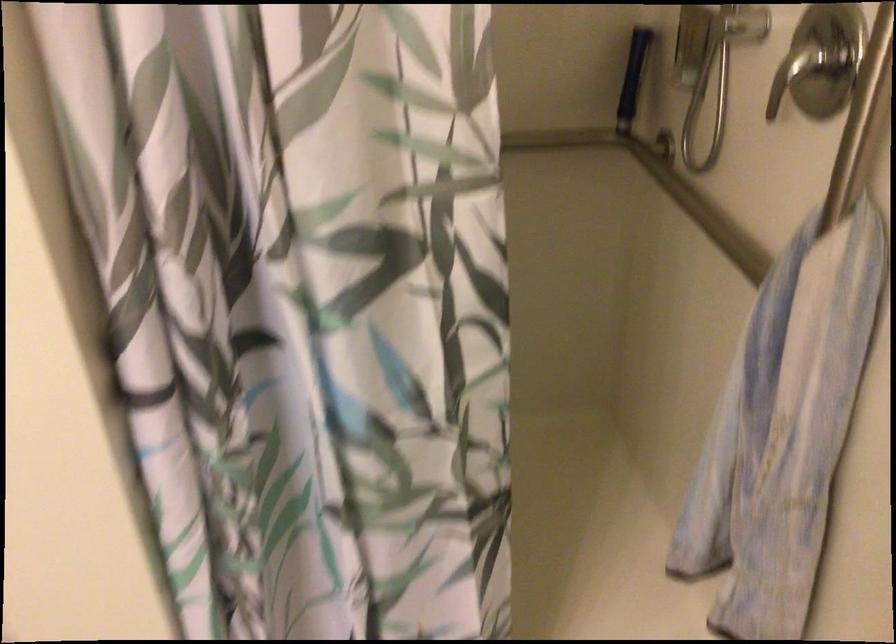
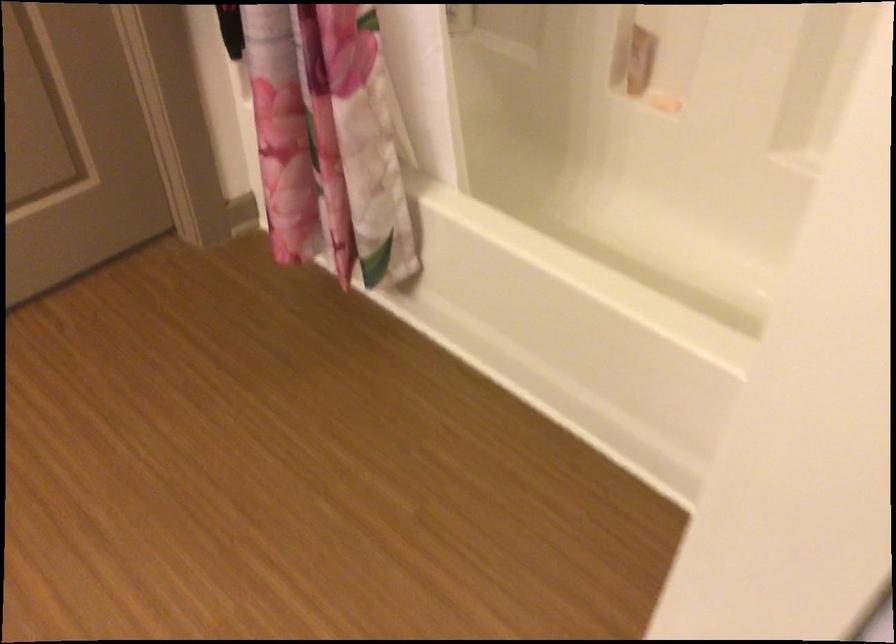
Based on the continuous images, in which direction is the camera rotating?

The camera's rotation is toward left-down.